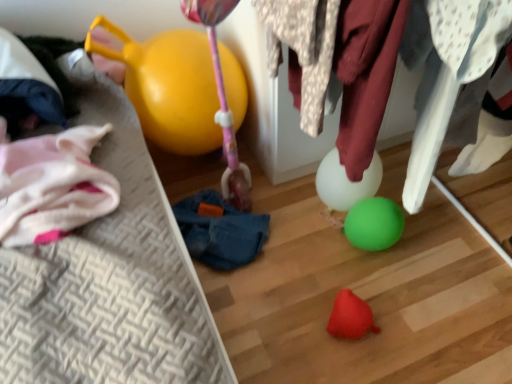
Question: In the image, is white fabric at upper right, marked as the first clothing in a right-to-left arrangement, positioned in front of or behind rubber red toy at lower center?

Choices:
 (A) behind
 (B) front

Answer: (B)

Question: In terms of size, does white fabric at upper right, marked as the first clothing in a right-to-left arrangement, appear bigger or smaller than rubber red toy at lower center?

Choices:
 (A) small
 (B) big

Answer: (B)

Question: Considering the real-world distances, which object is farthest from the blue fabric bean bag chair at center?

Choices:
 (A) spotted fabric at center, the 1th clothing in the left-to-right sequence
 (B) rubber red toy at lower center
 (C) white fabric at upper right, the 2th clothing viewed from the left
 (D) yellow rubber balloon at upper left

Answer: (C)

Question: Estimate the real-world distances between objects in this image. Which object is closer to the rubber red toy at lower center?

Choices:
 (A) blue fabric bean bag chair at center
 (B) yellow rubber balloon at upper left
 (C) white fabric at upper right, the 2th clothing viewed from the left
 (D) spotted fabric at center, which ranks as the 2th clothing in right-to-left order

Answer: (A)